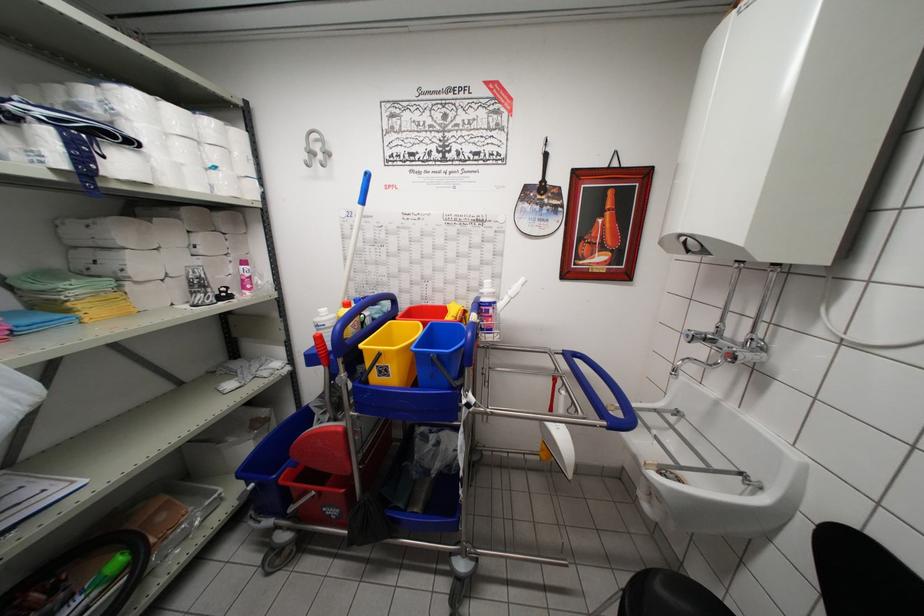
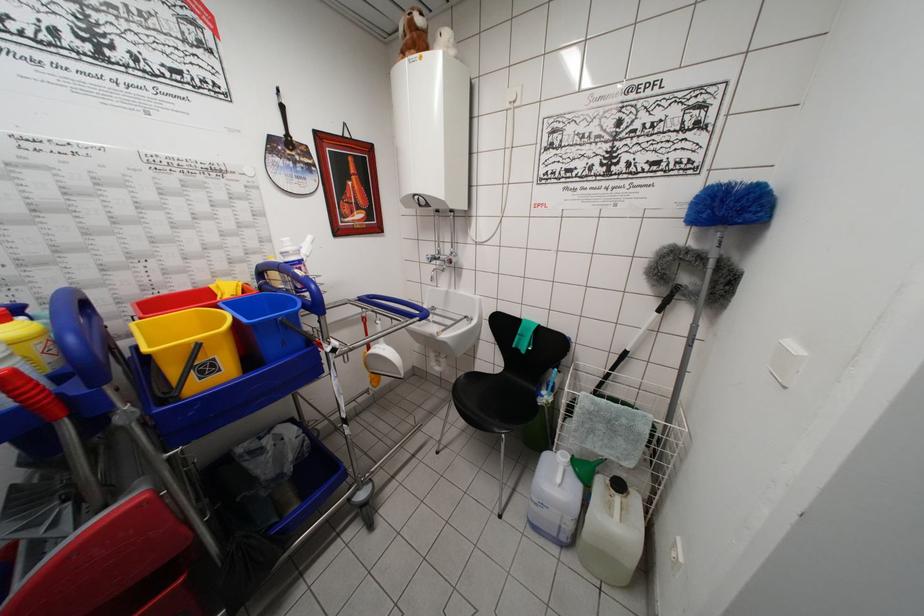
Where in the second image is the point corresponding to point 382,357 from the first image?

(200, 349)